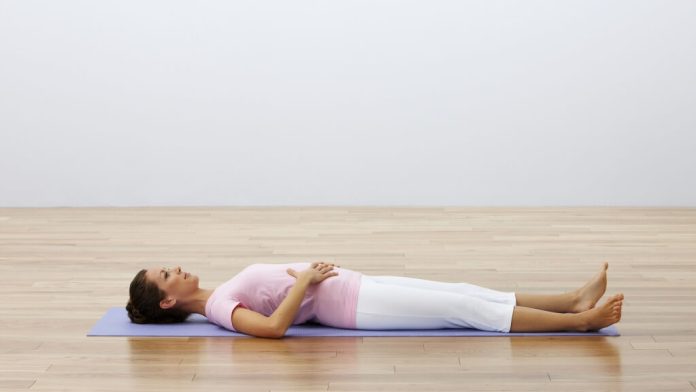
At what (x,y) coordinates should I click in order to perform the action: click on wood floor. Please return your answer as a coordinate pair (x, y). This screenshot has width=696, height=392. Looking at the image, I should click on (47, 299).